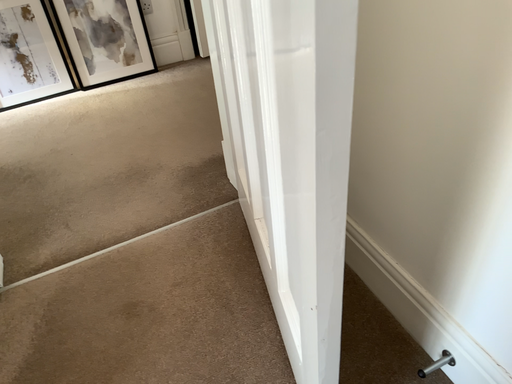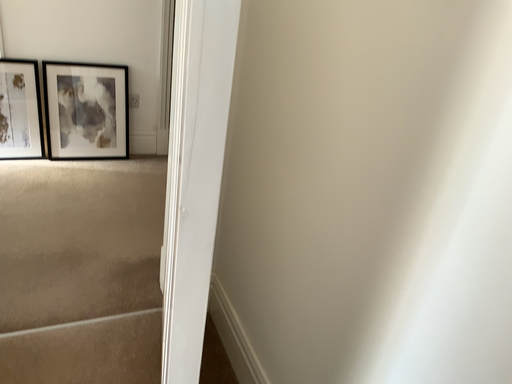
Question: How did the camera likely rotate when shooting the video?

Choices:
 (A) rotated upward
 (B) rotated downward

Answer: (A)